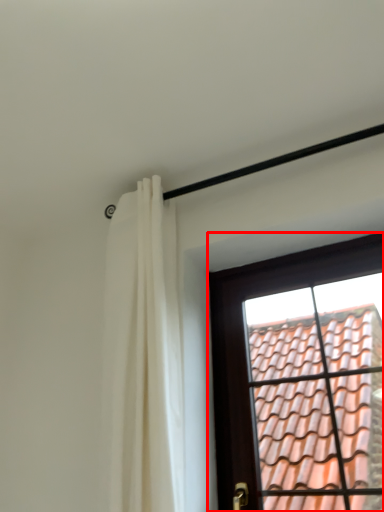
Question: Observing the image, what is the correct spatial positioning of window (annotated by the red box) in reference to curtain?

Choices:
 (A) left
 (B) right

Answer: (B)